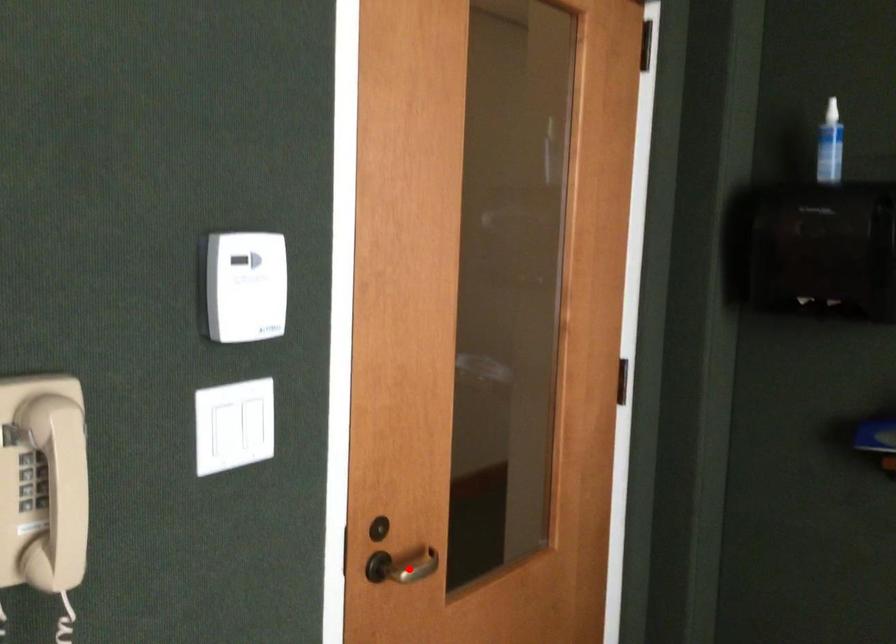
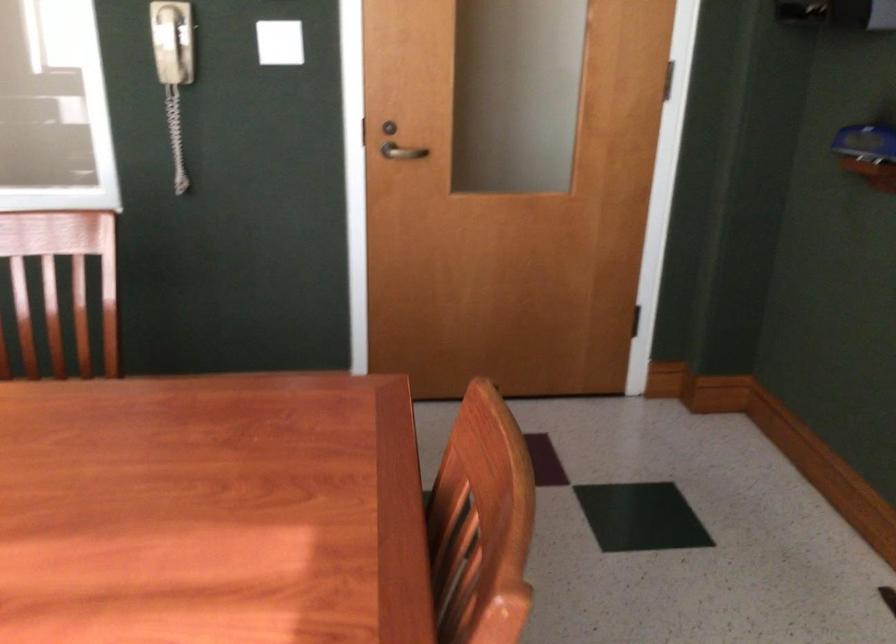
Question: A red point is marked in image1. In image2, is the corresponding 3D point closer to the camera or farther? Reply with the corresponding letter.

Choices:
 (A) The corresponding 3D point is closer.
 (B) The corresponding 3D point is farther.

Answer: (B)